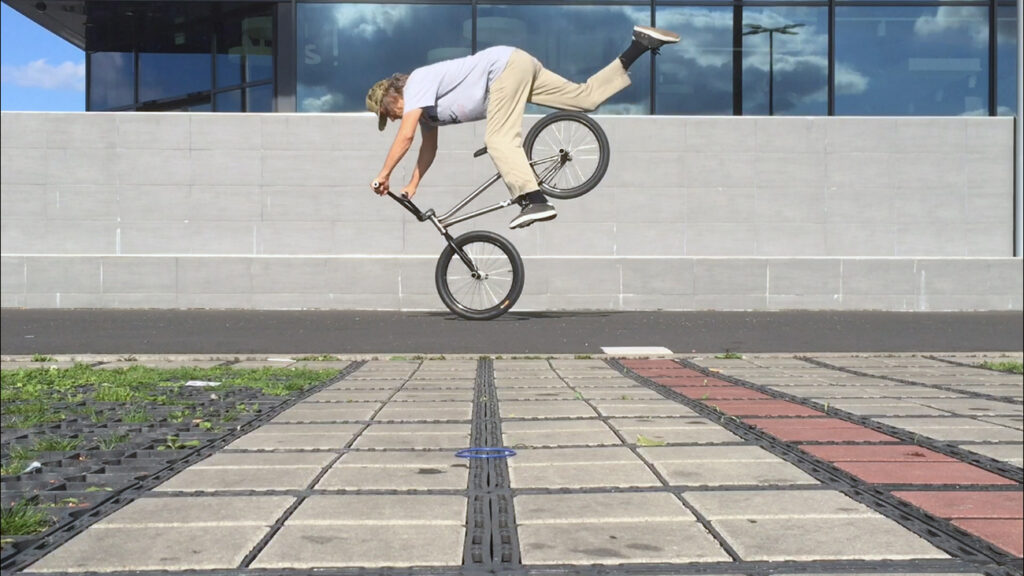
This screenshot has width=1024, height=576. Find the location of `wall`. wall is located at coordinates (308, 178).